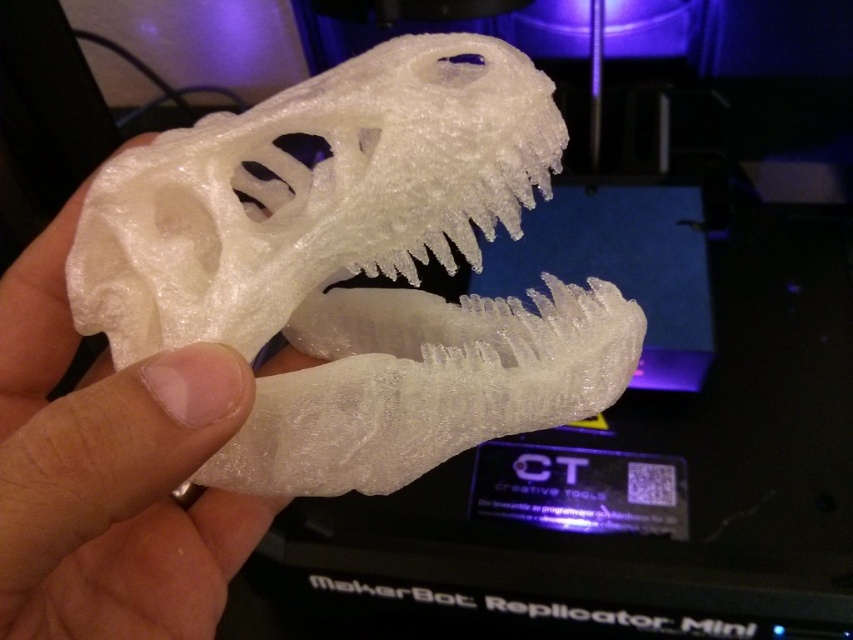
You are an artist trying to position the white matte plastic dinosaur skull at center and the white matte plastic hand at center for a photo shoot. Based on the scene, which object is located to the right side of the other?

The white matte plastic dinosaur skull at center is to the right of the white matte plastic hand at center.

From the picture: You are a robotic arm trying to pick up the white matte plastic dinosaur skull at center and the white matte plastic hand at center. The robotic arm has a maximum reach of 6 inches. Can it reach both objects without moving its base?

The white matte plastic dinosaur skull at center is 6.35 inches away from the white matte plastic hand at center. Since the robotic arm can only reach 6 inches, it cannot reach both objects without moving its base because the distance between them exceeds its reach.

You are an artist working with 3D models. You have a white matte plastic dinosaur skull at center and a white matte plastic hand at center in your workspace. If you want to place both items on a display shelf, which one should you position first to ensure they both fit comfortably?

The white matte plastic dinosaur skull at center is smaller than the white matte plastic hand at center. Position the larger item, the white matte plastic hand at center, first to accommodate the smaller one comfortably.